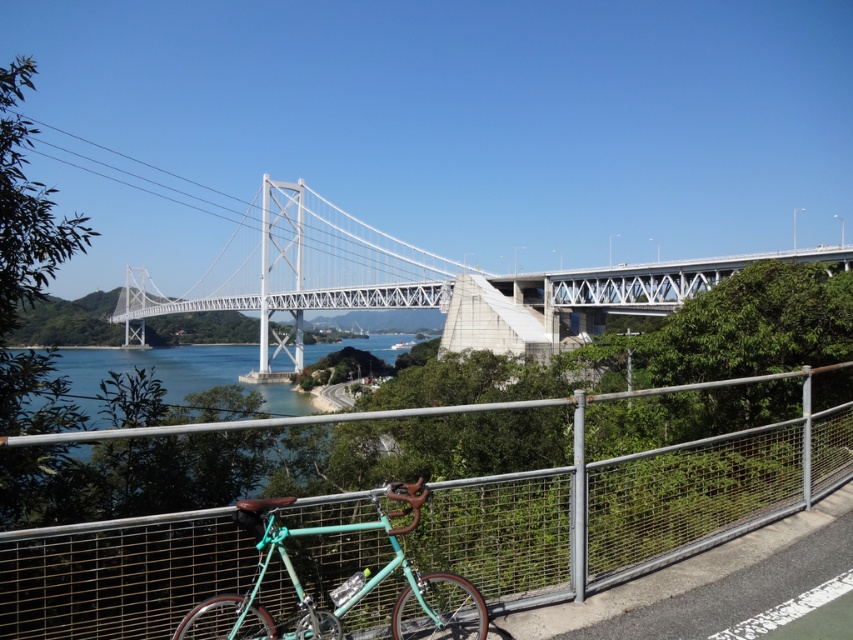
You are standing at the fence near the turquoise bicycle and want to walk towards the bridge. Which point, point (x=492, y=545) or point (x=279, y=209), is closer to you as you start walking towards the bridge?

Point (x=492, y=545) is closer to the viewer than point (x=279, y=209), so it will be the first point you encounter as you walk towards the bridge.

Looking at this image, you are standing at the edge of the bridge and want to take a photo of the metal mesh fence at lower center. If your camera has a maximum focus distance of 3 meters, will you be able to capture the fence clearly?

The metal mesh fence at lower center and viewer are 3.48 meters apart from each other. Since the distance is greater than the camera maximum focus distance of 3 meters, the camera won not be able to capture the fence clearly.